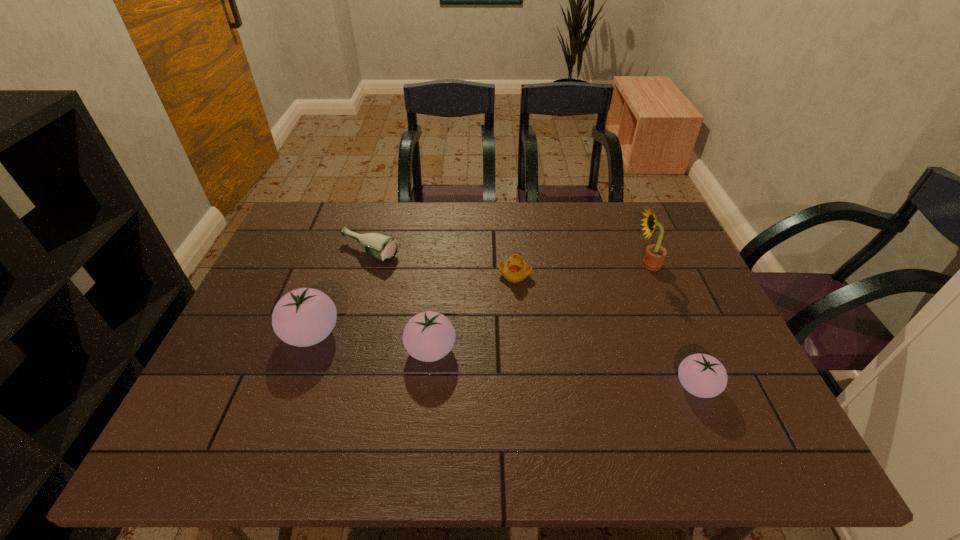
Locate an element on the screen. The image size is (960, 540). vacant area between the bottle and the fifth shortest object is located at coordinates point(340,293).

Where is `object that stands as the second closest to the rightmost tomato`? Image resolution: width=960 pixels, height=540 pixels. object that stands as the second closest to the rightmost tomato is located at coordinates (515, 270).

This screenshot has height=540, width=960. I want to click on object that stands as the fourth closest to the duckling, so click(702, 375).

You are a GUI agent. You are given a task and a screenshot of the screen. Output one action in this format:
    pyautogui.click(x=<x>, y=<y>)
    Task: Click on the tomato that stands as the second closest to the second tomato from left to right
    
    Given the screenshot: What is the action you would take?
    pyautogui.click(x=702, y=375)

Where is `tomato that is the closest to the third shortest object`? The width and height of the screenshot is (960, 540). tomato that is the closest to the third shortest object is located at coordinates (428, 336).

Identify the location of vacant space that satisfies the following two spatial constraints: 1. on the front-facing side of the duckling; 2. on the right side of the rightmost tomato. (524, 386).